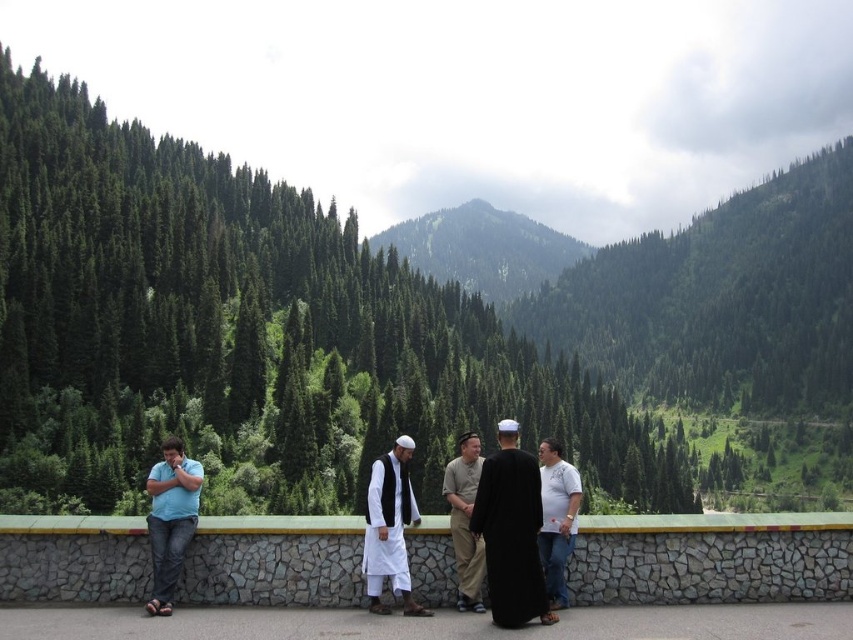
Question: Which object is closer to the camera taking this photo?

Choices:
 (A) green forested mountain at center
 (B) light brown cotton shirt at center
 (C) white cotton robe at center

Answer: (C)

Question: Can you confirm if green leafy trees at center is wider than light brown cotton shirt at center?

Choices:
 (A) no
 (B) yes

Answer: (B)

Question: Which of the following is the farthest from the observer?

Choices:
 (A) (386, 481)
 (B) (570, 504)
 (C) (537, 508)

Answer: (A)

Question: Does green leafy trees at center come in front of light brown cotton shirt at center?

Choices:
 (A) no
 (B) yes

Answer: (A)

Question: Is white cotton shirt at center to the left of light brown cotton shirt at center from the viewer's perspective?

Choices:
 (A) no
 (B) yes

Answer: (A)

Question: Among these points, which one is nearest to the camera?

Choices:
 (A) (575, 528)
 (B) (376, 241)

Answer: (A)